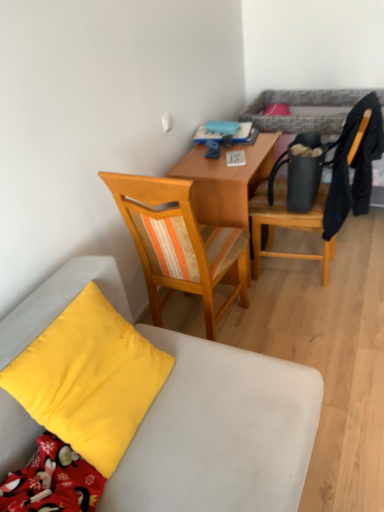
Locate an element on the screen. matte black chair at upper right, the first chair in the right-to-left sequence is located at coordinates (287, 224).

The image size is (384, 512). What do you see at coordinates (225, 181) in the screenshot?
I see `wooden desk at center` at bounding box center [225, 181].

Image resolution: width=384 pixels, height=512 pixels. I want to click on black fabric bed at upper right, so click(299, 106).

You are a GUI agent. You are given a task and a screenshot of the screen. Output one action in this format:
    pyautogui.click(x=<x>, y=<y>)
    Task: Click on the yellow matte pillow at lower left
    This screenshot has width=384, height=512.
    Given the screenshot: What is the action you would take?
    pyautogui.click(x=89, y=379)

Which point is more distant from viewer, (x=312, y=120) or (x=108, y=447)?

The point (x=312, y=120) is farther from the camera.

Considering the sizes of black fabric bed at upper right and yellow matte pillow at lower left in the image, is black fabric bed at upper right bigger or smaller than yellow matte pillow at lower left?

Clearly, black fabric bed at upper right is larger in size than yellow matte pillow at lower left.

Considering the points (118, 317) and (200, 250), which point is behind, point (118, 317) or point (200, 250)?

Point (200, 250)

The width and height of the screenshot is (384, 512). I want to click on pillow above the wooden chair at center, positioned as the third chair in right-to-left order (from a real-world perspective), so click(89, 379).

Can you confirm if yellow matte pillow at lower left is thinner than wooden chair at center, arranged as the 1th chair when viewed from the left?

Correct, the width of yellow matte pillow at lower left is less than that of wooden chair at center, arranged as the 1th chair when viewed from the left.

Is wooden chair at center, positioned as the third chair in right-to-left order, completely or partially inside yellow matte pillow at lower left?

No.

Is point (260, 125) farther from camera compared to point (173, 234)?

Yes, point (260, 125) is farther from viewer.

From the image's perspective, does black fabric bed at upper right appear lower than wooden chair at center, arranged as the 1th chair when viewed from the left?

No, from the image's perspective, black fabric bed at upper right is not below wooden chair at center, arranged as the 1th chair when viewed from the left.

Are black fabric bed at upper right and wooden chair at center, arranged as the 1th chair when viewed from the left, making contact?

No, black fabric bed at upper right is not making contact with wooden chair at center, arranged as the 1th chair when viewed from the left.

How different are the orientations of wooden desk at center and yellow matte pillow at lower left in degrees?

The angular difference between wooden desk at center and yellow matte pillow at lower left is 3.26 degrees.

In the scene shown: From the image's perspective, would you say wooden desk at center is positioned over yellow matte pillow at lower left?

Yes, from the image's perspective, wooden desk at center is on top of yellow matte pillow at lower left.

Is wooden desk at center turned away from yellow matte pillow at lower left?

No, wooden desk at center is not facing away from yellow matte pillow at lower left.

Does wooden desk at center come behind yellow matte pillow at lower left?

Yes, wooden desk at center is behind yellow matte pillow at lower left.

Considering the positions of objects matte black chair at upper right, which appears as the 3th chair when viewed from the left, and wooden desk at center in the image provided, who is in front, matte black chair at upper right, which appears as the 3th chair when viewed from the left, or wooden desk at center?

matte black chair at upper right, which appears as the 3th chair when viewed from the left.

From the image's perspective, is matte black chair at upper right, which appears as the 3th chair when viewed from the left, above or below wooden desk at center?

matte black chair at upper right, which appears as the 3th chair when viewed from the left, is situated higher than wooden desk at center in the image.

Is matte black chair at upper right, the first chair in the right-to-left sequence, inside the boundaries of wooden desk at center, or outside?

matte black chair at upper right, the first chair in the right-to-left sequence, is outside wooden desk at center.

Which is further, (257,249) or (239,175)?

The point (257,249) is behind.

Considering the relative positions of wooden desk at center and wooden chair at center, positioned as the third chair in right-to-left order, in the image provided, is wooden desk at center to the right of wooden chair at center, positioned as the third chair in right-to-left order, from the viewer's perspective?

Yes, wooden desk at center is to the right of wooden chair at center, positioned as the third chair in right-to-left order.

Which is behind, point (223, 175) or point (174, 188)?

The point (223, 175) is farther from the camera.

Does wooden desk at center have a smaller size compared to wooden chair at center, positioned as the third chair in right-to-left order?

Correct, wooden desk at center occupies less space than wooden chair at center, positioned as the third chair in right-to-left order.

Looking at this image, in terms of height, does wooden chair at center, the second chair positioned from the left, look taller or shorter compared to matte black chair at upper right, which appears as the 3th chair when viewed from the left?

Clearly, wooden chair at center, the second chair positioned from the left, is shorter compared to matte black chair at upper right, which appears as the 3th chair when viewed from the left.

Which is more to the right, wooden chair at center, arranged as the 2th chair when viewed from the right, or matte black chair at upper right, the first chair in the right-to-left sequence?

From the viewer's perspective, matte black chair at upper right, the first chair in the right-to-left sequence, appears more on the right side.

Is matte black chair at upper right, the first chair in the right-to-left sequence, located within wooden chair at center, the second chair positioned from the left?

No, matte black chair at upper right, the first chair in the right-to-left sequence, is not inside wooden chair at center, the second chair positioned from the left.

Locate an element on the screen. Image resolution: width=384 pixels, height=512 pixels. bed on the right side of yellow matte pillow at lower left is located at coordinates (299, 106).

Where is `the 2nd chair above the yellow matte pillow at lower left (from the image's perspective)`? The height and width of the screenshot is (512, 384). the 2nd chair above the yellow matte pillow at lower left (from the image's perspective) is located at coordinates (179, 243).

Which object lies further to the anchor point wooden chair at center, arranged as the 1th chair when viewed from the left, wooden desk at center or yellow matte pillow at lower left?

yellow matte pillow at lower left is further to wooden chair at center, arranged as the 1th chair when viewed from the left.

Considering their positions, is wooden chair at center, arranged as the 2th chair when viewed from the right, positioned closer to wooden chair at center, positioned as the third chair in right-to-left order, than yellow matte pillow at lower left?

wooden chair at center, arranged as the 2th chair when viewed from the right, lies closer to wooden chair at center, positioned as the third chair in right-to-left order, than the other object.

Looking at the image, which one is located closer to black fabric bed at upper right, matte black chair at upper right, which appears as the 3th chair when viewed from the left, or yellow matte pillow at lower left?

Among the two, matte black chair at upper right, which appears as the 3th chair when viewed from the left, is located nearer to black fabric bed at upper right.

Looking at the image, which one is located closer to wooden desk at center, yellow matte pillow at lower left or black fabric bed at upper right?

Based on the image, black fabric bed at upper right appears to be nearer to wooden desk at center.

From the image, which object appears to be nearer to wooden chair at center, the second chair positioned from the left, black fabric bed at upper right or wooden desk at center?

Based on the image, wooden desk at center appears to be nearer to wooden chair at center, the second chair positioned from the left.

When comparing their distances from wooden chair at center, arranged as the 2th chair when viewed from the right, does yellow matte pillow at lower left or wooden chair at center, positioned as the third chair in right-to-left order, seem further?

wooden chair at center, positioned as the third chair in right-to-left order, is further to wooden chair at center, arranged as the 2th chair when viewed from the right.

Considering their positions, is wooden chair at center, arranged as the 1th chair when viewed from the left, positioned closer to wooden chair at center, arranged as the 2th chair when viewed from the right, than matte black chair at upper right, the first chair in the right-to-left sequence?

wooden chair at center, arranged as the 1th chair when viewed from the left, lies closer to wooden chair at center, arranged as the 2th chair when viewed from the right, than the other object.

Based on the photo, considering their positions, is matte black chair at upper right, which appears as the 3th chair when viewed from the left, positioned closer to wooden desk at center than wooden chair at center, arranged as the 1th chair when viewed from the left?

matte black chair at upper right, which appears as the 3th chair when viewed from the left, is positioned closer to the anchor wooden desk at center.

Find the location of `desk between wooden chair at center, arranged as the 1th chair when viewed from the left, and matte black chair at upper right, which appears as the 3th chair when viewed from the left, from left to right`. desk between wooden chair at center, arranged as the 1th chair when viewed from the left, and matte black chair at upper right, which appears as the 3th chair when viewed from the left, from left to right is located at coordinates (225, 181).

Locate an element on the screen. Image resolution: width=384 pixels, height=512 pixels. chair between yellow matte pillow at lower left and wooden chair at center, the second chair positioned from the left, in the horizontal direction is located at coordinates (179, 243).

At what (x,y) coordinates should I click in order to perform the action: click on bed between yellow matte pillow at lower left and wooden desk at center in the front-back direction. Please return your answer as a coordinate pair (x, y). The width and height of the screenshot is (384, 512). Looking at the image, I should click on (299, 106).

At what (x,y) coordinates should I click in order to perform the action: click on desk between wooden chair at center, arranged as the 1th chair when viewed from the left, and black fabric bed at upper right, in the horizontal direction. Please return your answer as a coordinate pair (x, y). The height and width of the screenshot is (512, 384). Looking at the image, I should click on (225, 181).